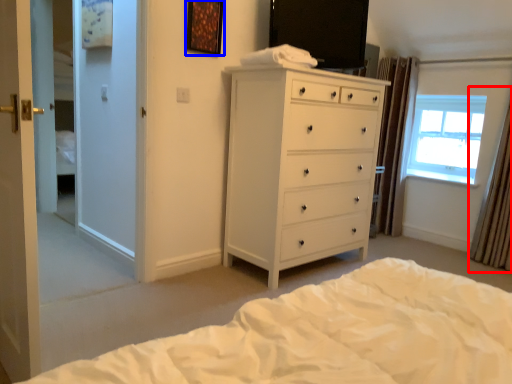
Question: Among these objects, which one is nearest to the camera, curtain (highlighted by a red box) or picture frame (highlighted by a blue box)?

Choices:
 (A) curtain
 (B) picture frame

Answer: (B)